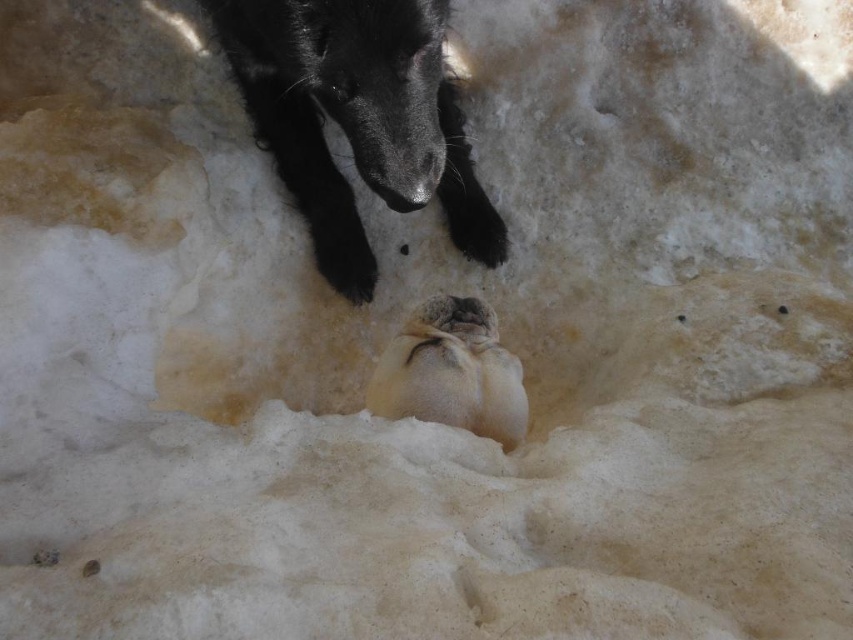
You are an observer looking at the snowy scene. You see the black fur animal at upper center and the fuzzy white seal at center. Which animal is positioned to the left of the other?

The black fur animal at upper center is positioned to the left of the fuzzy white seal at center.

You are a photographer standing at the camera position. You want to take a closeup photo of the black fur animal at upper center. Can you get within 1 meter to take the photo without moving the animal?

The black fur animal at upper center is 1.45 meters away from camera. Since the photographer is at the camera position, they can move closer by 0.45 meters to get within 1 meter without moving the animal.

You are a wildlife photographer trying to capture a photo of both the black fur animal at upper center and the fuzzy white seal at center. Since you want both subjects to appear equally prominent in the photo, which animal should you zoom in on more?

The black fur animal at upper center is larger in size than the fuzzy white seal at center, so you should zoom in more on the fuzzy white seal at center to make it appear as prominent as the larger animal.